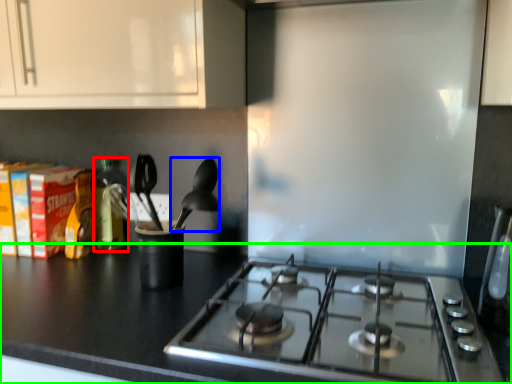
Question: Considering the real-world distances, which object is farthest from bottle (highlighted by a red box)? silverware (highlighted by a blue box) or countertop (highlighted by a green box)?

Choices:
 (A) silverware
 (B) countertop

Answer: (B)